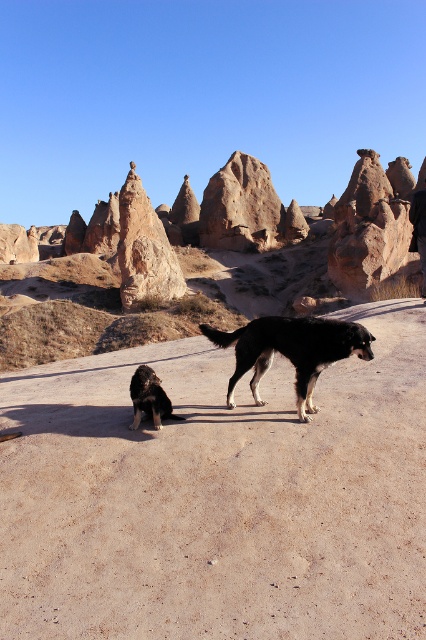
You are a photographer planning to capture a wide shot of the fairy chimneys and both dogs in the scene. Given that your camera has a maximum focus range of 40 feet, will you be able to ensure both the black fur dog at center and the other dog are in focus simultaneously?

The two dogs are 38.94 feet apart. Since the distance between them is within the camera maximum focus range of 40 feet, you can capture both the black fur dog at center and the other dog in focus simultaneously.

You are a photographer trying to capture the black fur dog at lower left and the black leather pants at center in the same frame. Based on their positions, which object should you adjust your camera to focus on first to ensure both are in the shot?

The black fur dog at lower left is to the left of black leather pants at center, so you should focus on the black fur dog at lower left first to ensure both are included in the frame.